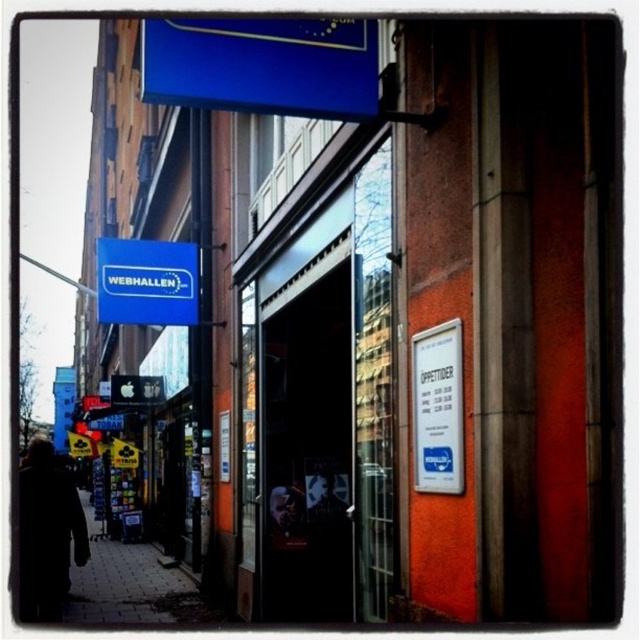
Question: Which of the following is the closest to the observer?

Choices:
 (A) (45, 484)
 (B) (173, 321)

Answer: (A)

Question: Considering the relative positions of black coat at lower left and blue matte sign at upper left in the image provided, where is black coat at lower left located with respect to blue matte sign at upper left?

Choices:
 (A) right
 (B) left

Answer: (B)

Question: Does black coat at lower left have a smaller size compared to blue matte sign at upper left?

Choices:
 (A) yes
 (B) no

Answer: (B)

Question: Can you confirm if black coat at lower left is positioned below blue matte sign at upper left?

Choices:
 (A) no
 (B) yes

Answer: (B)

Question: Which point appears closest to the camera in this image?

Choices:
 (A) (132, 264)
 (B) (68, 566)

Answer: (B)